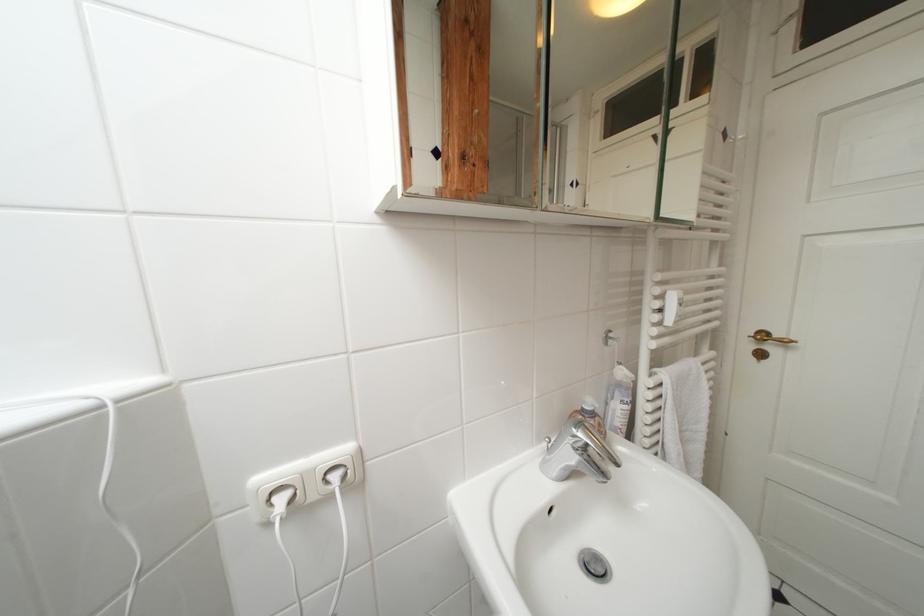
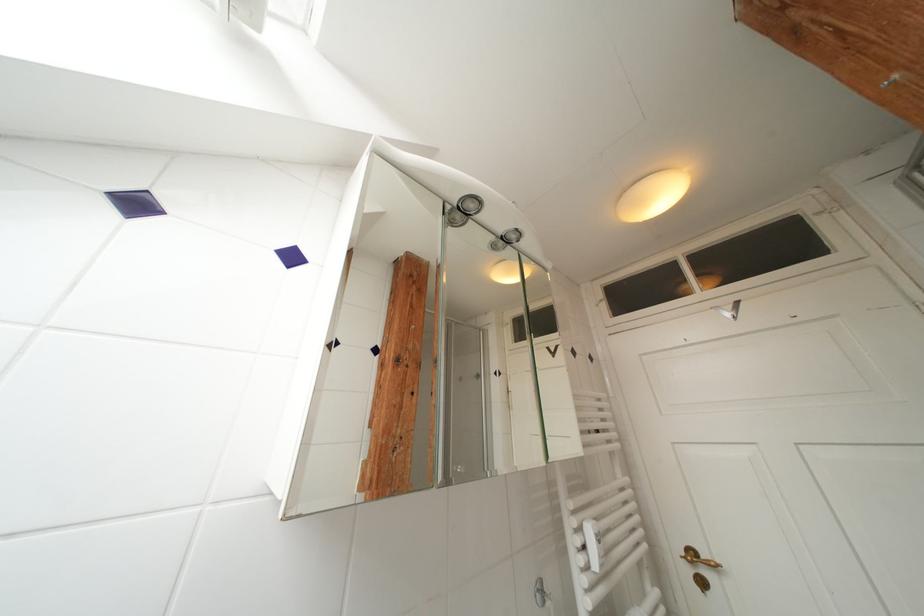
The point at (769, 339) is marked in the first image. Where is the corresponding point in the second image?

(699, 557)